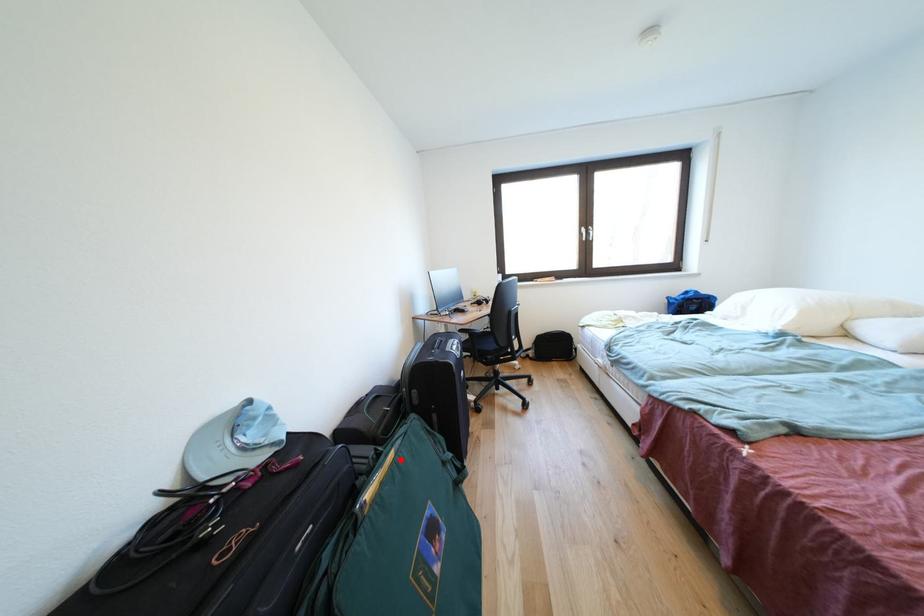
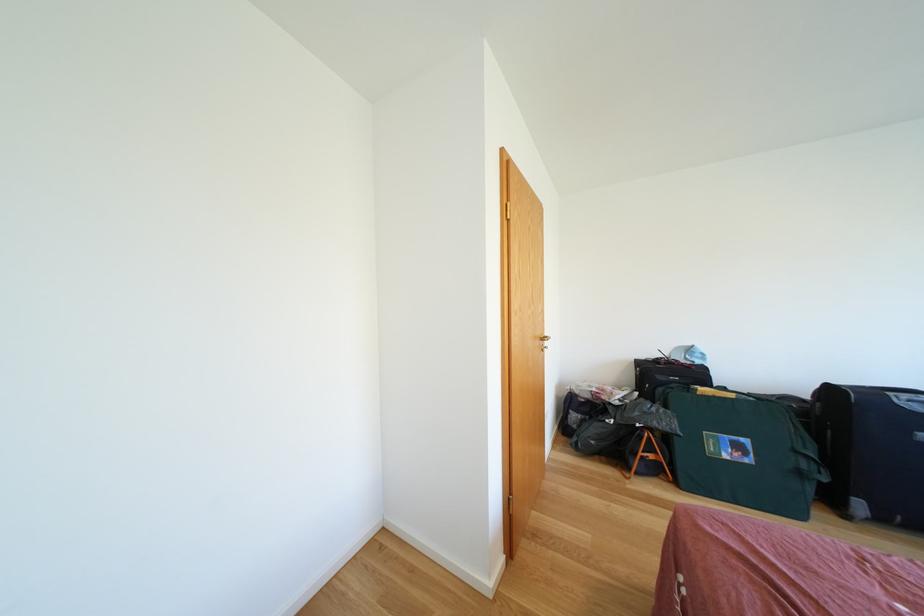
Where in the second image is the point corresponding to the highlighted location from the first image?

(739, 400)